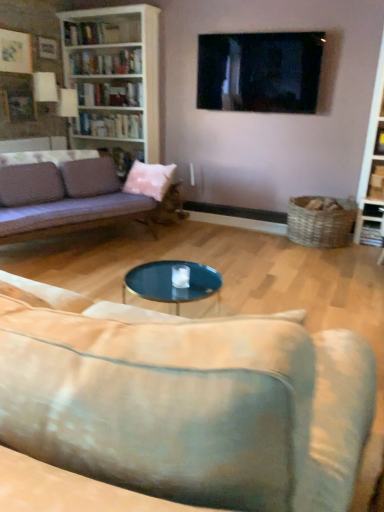
Question: Is black glossy tv at upper center turned away from white wood bookcase at upper left?

Choices:
 (A) no
 (B) yes

Answer: (A)

Question: From a real-world perspective, is black glossy tv at upper center over white wood bookcase at upper left?

Choices:
 (A) no
 (B) yes

Answer: (B)

Question: Is black glossy tv at upper center oriented towards white wood bookcase at upper left?

Choices:
 (A) yes
 (B) no

Answer: (B)

Question: Is black glossy tv at upper center with white wood bookcase at upper left?

Choices:
 (A) yes
 (B) no

Answer: (B)

Question: Considering the relative sizes of black glossy tv at upper center and white wood bookcase at upper left in the image provided, is black glossy tv at upper center thinner than white wood bookcase at upper left?

Choices:
 (A) yes
 (B) no

Answer: (A)

Question: From the image's perspective, is white glossy bookshelf at upper left, which is the first book in top-to-bottom order, located above or below pink fabric pillow at center?

Choices:
 (A) above
 (B) below

Answer: (A)

Question: Is white glossy bookshelf at upper left, which is the first book in top-to-bottom order, inside the boundaries of pink fabric pillow at center, or outside?

Choices:
 (A) outside
 (B) inside

Answer: (A)

Question: Does point (130, 58) appear closer or farther from the camera than point (137, 180)?

Choices:
 (A) farther
 (B) closer

Answer: (A)

Question: Is white glossy bookshelf at upper left, which is the first book in top-to-bottom order, in front of or behind pink fabric pillow at center in the image?

Choices:
 (A) front
 (B) behind

Answer: (B)

Question: Considering the positions of hardcover books at upper left, the second book from the top, and white wood bookcase at upper left in the image, is hardcover books at upper left, the second book from the top, wider or thinner than white wood bookcase at upper left?

Choices:
 (A) wide
 (B) thin

Answer: (B)

Question: Considering the positions of hardcover books at upper left, the second book from the top, and white wood bookcase at upper left in the image, is hardcover books at upper left, the second book from the top, taller or shorter than white wood bookcase at upper left?

Choices:
 (A) short
 (B) tall

Answer: (A)

Question: Is hardcover books at upper left, the first book from the bottom, in front of or behind white wood bookcase at upper left in the image?

Choices:
 (A) front
 (B) behind

Answer: (B)

Question: Considering the relative positions of hardcover books at upper left, the first book from the bottom, and white wood bookcase at upper left in the image provided, is hardcover books at upper left, the first book from the bottom, to the left or to the right of white wood bookcase at upper left?

Choices:
 (A) right
 (B) left

Answer: (A)

Question: Considering their positions, is hardcover books at upper left, the first book from the bottom, located in front of or behind velvet purple couch at left, the first studio couch viewed from the back?

Choices:
 (A) front
 (B) behind

Answer: (B)

Question: Considering the positions of hardcover books at upper left, the first book from the bottom, and velvet purple couch at left, the second studio couch positioned from the front, in the image, is hardcover books at upper left, the first book from the bottom, bigger or smaller than velvet purple couch at left, the second studio couch positioned from the front,?

Choices:
 (A) small
 (B) big

Answer: (A)